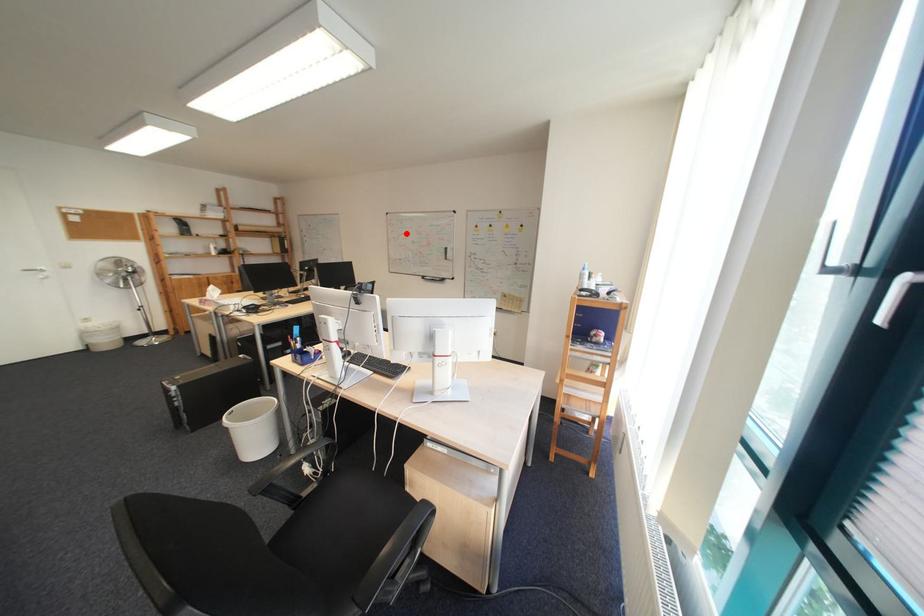
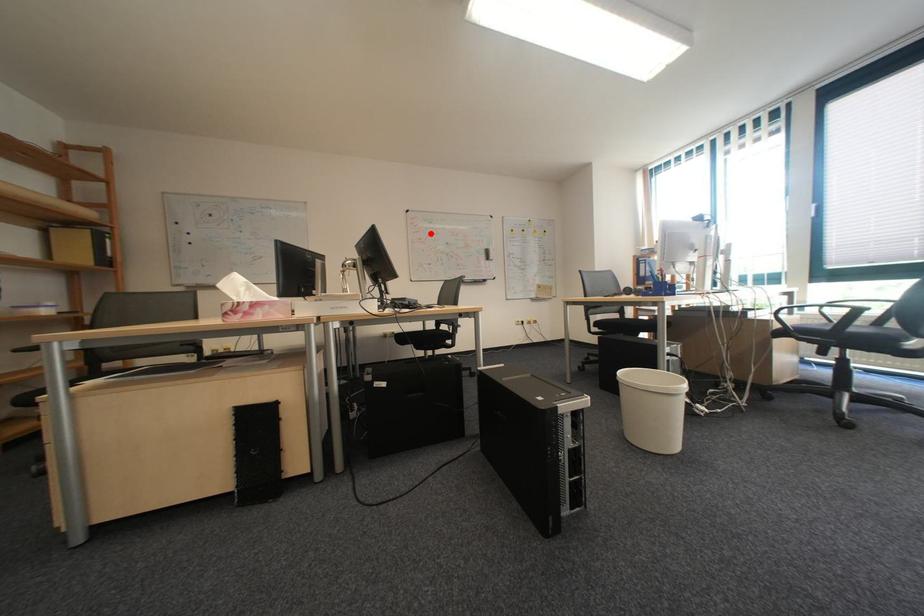
I am providing you with two images of the same scene from different viewpoints. A red point is marked on the first image and another point is marked on the second image. Is the red point in image1 aligned with the point shown in image2?

Yes